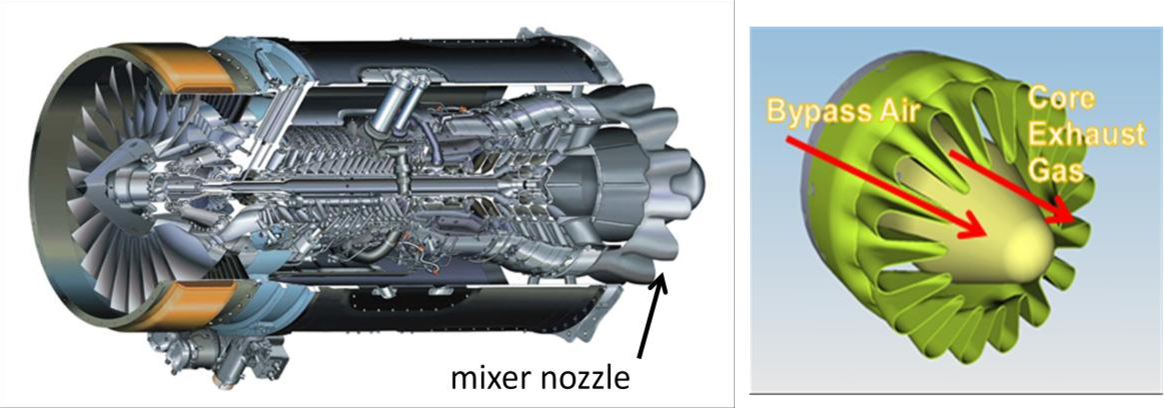
Where is `mixer`? The image size is (1164, 408). mixer is located at coordinates click(490, 377).